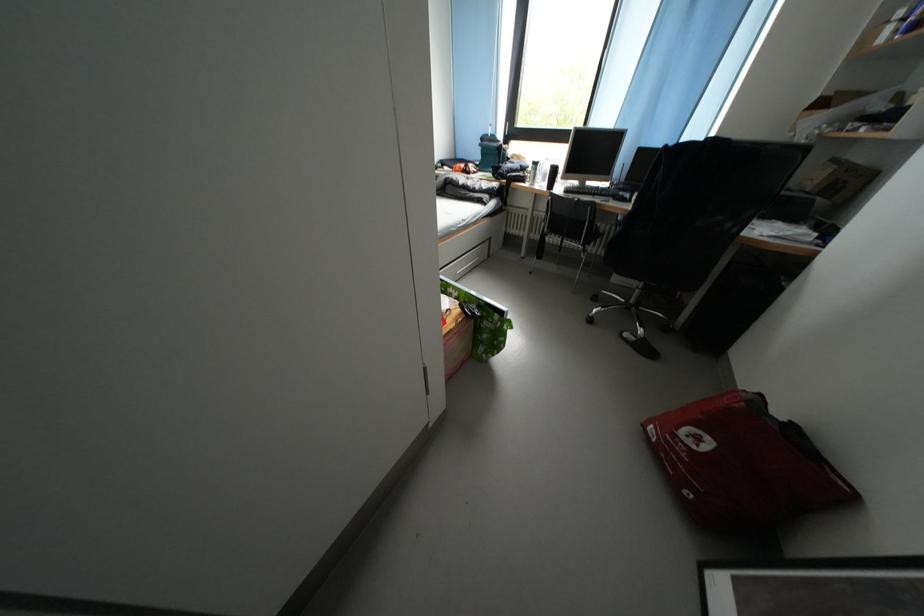
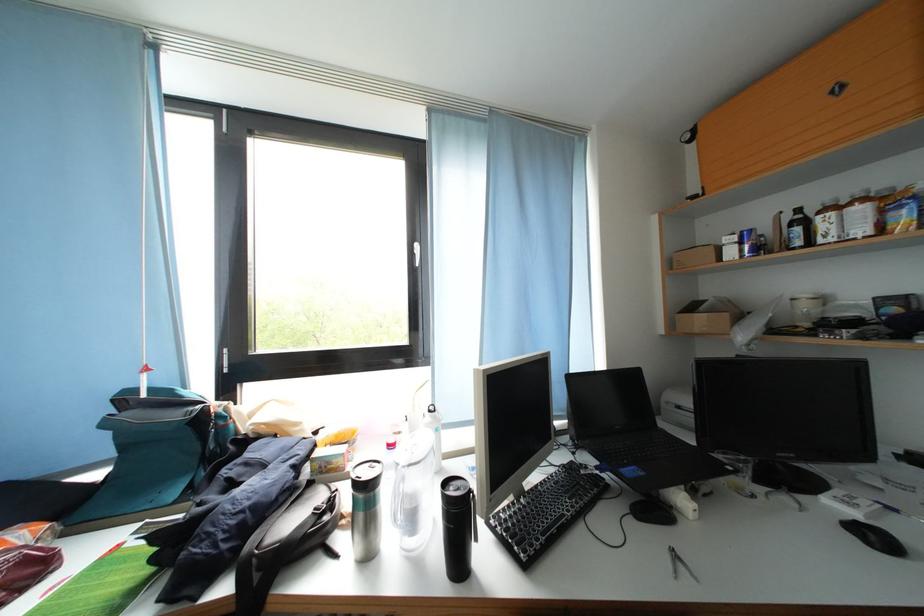
Where in the second image is the point corresponding to point (488, 151) from the first image?

(114, 429)